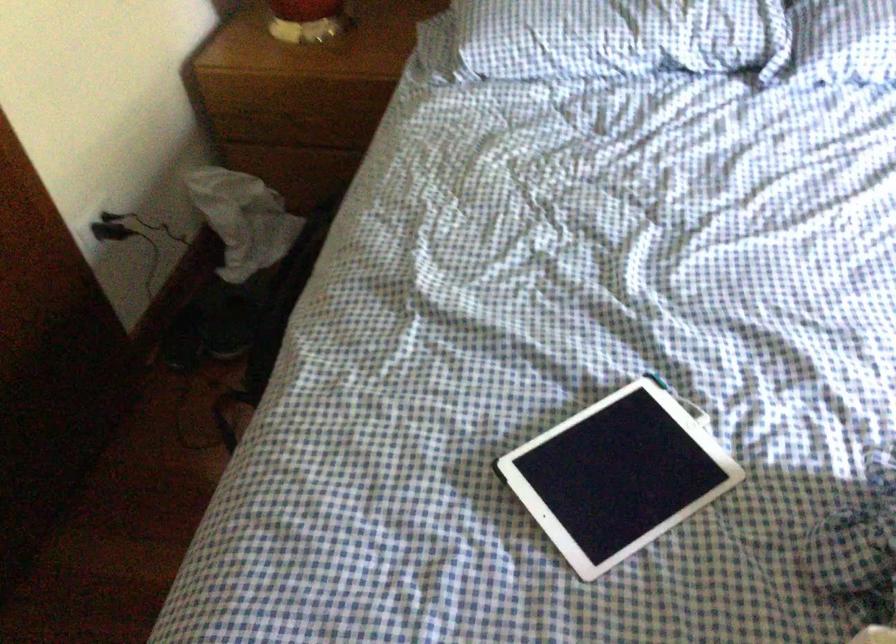
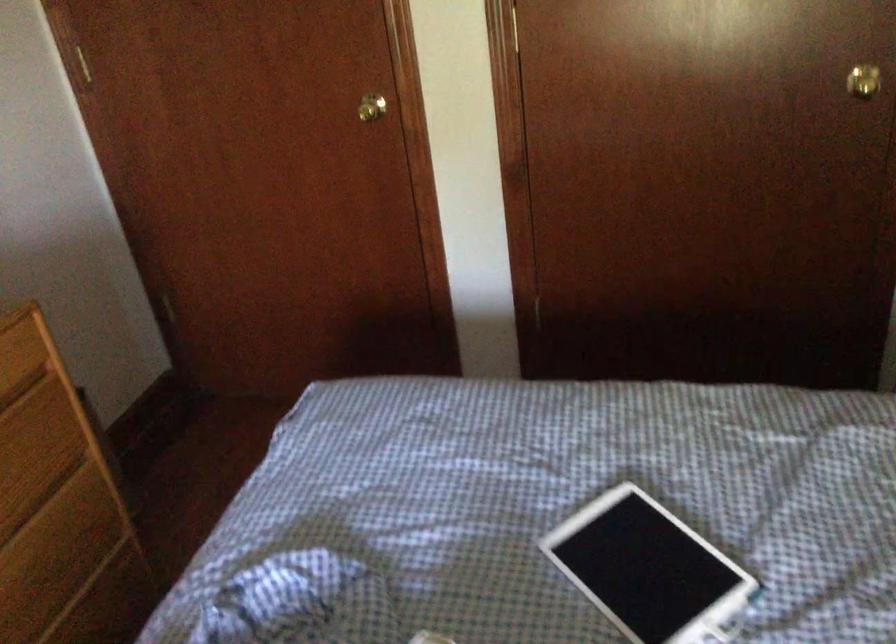
The first image is from the beginning of the video and the second image is from the end. How did the camera likely rotate when shooting the video?

The camera's rotation is toward left-down.